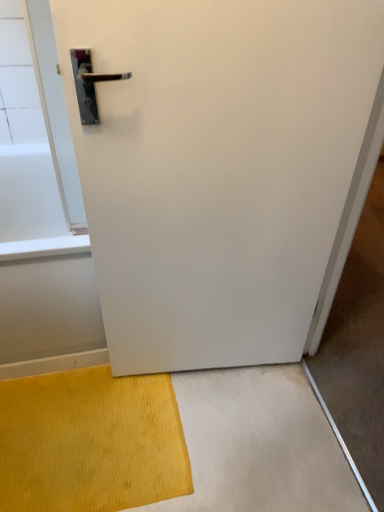
What are the coordinates of `vacant space in front of white matte door at center` in the screenshot? It's located at (230, 439).